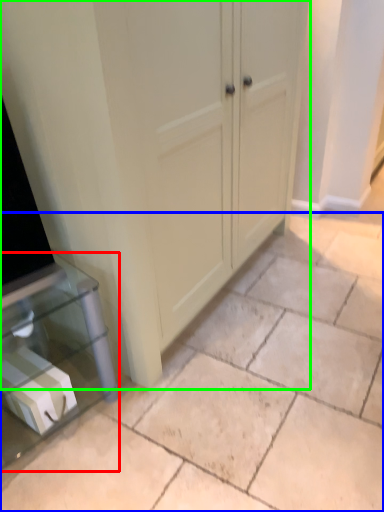
Question: Estimate the real-world distances between objects in this image. Which object is closer to furniture (highlighted by a red box), concrete (highlighted by a blue box) or cupboard (highlighted by a green box)?

Choices:
 (A) concrete
 (B) cupboard

Answer: (A)